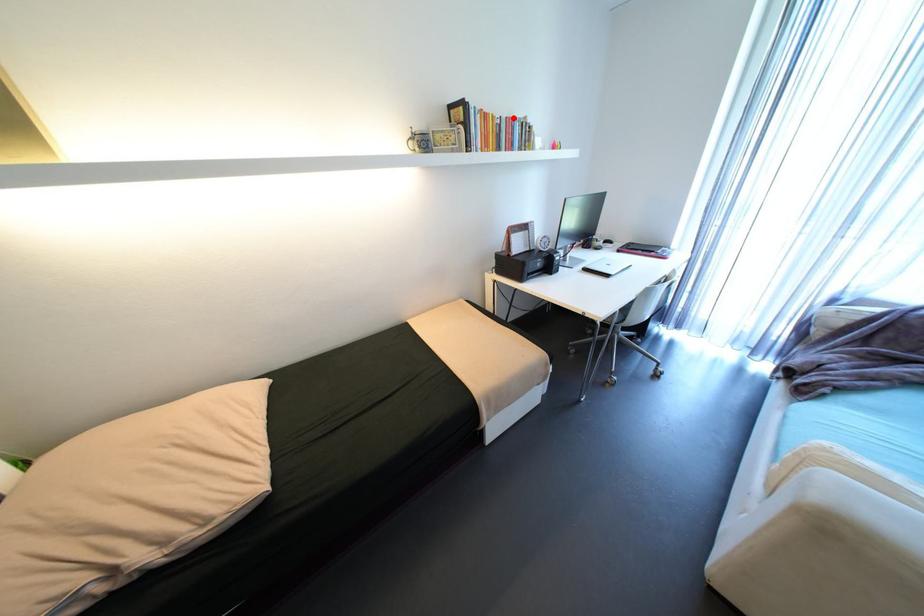
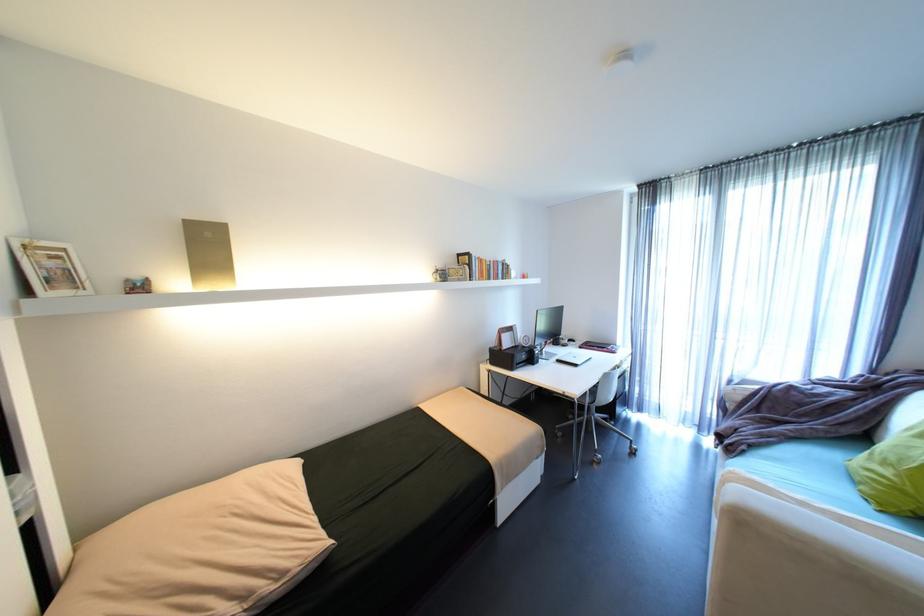
Locate, in the second image, the point that corresponds to the highlighted location in the first image.

(500, 262)